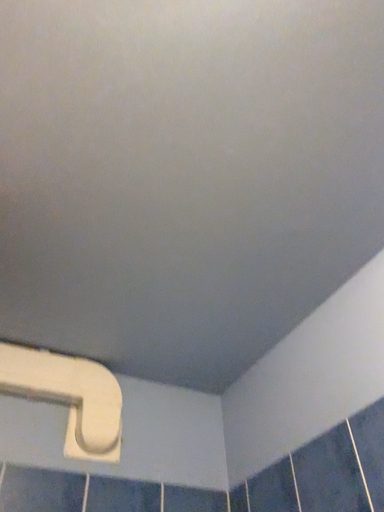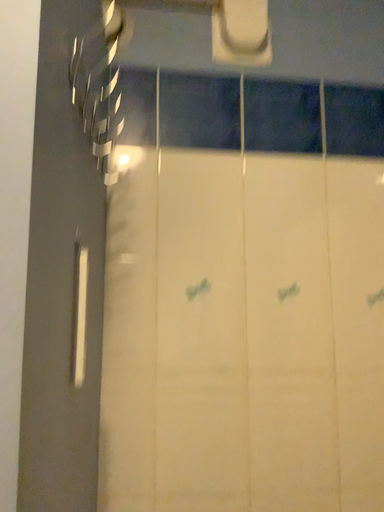
Question: How did the camera likely rotate when shooting the video?

Choices:
 (A) rotated left
 (B) rotated right

Answer: (A)